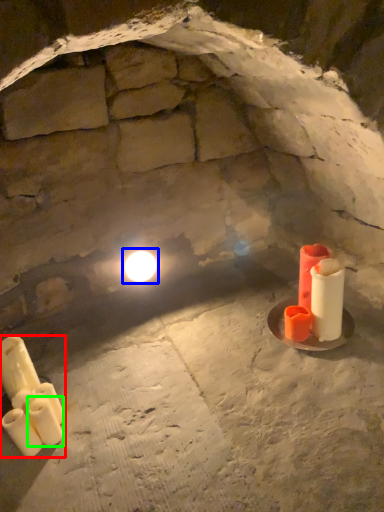
Question: Estimate the real-world distances between objects in this image. Which object is closer to candle (highlighted by a red box), light (highlighted by a blue box) or candle (highlighted by a green box)?

Choices:
 (A) light
 (B) candle

Answer: (B)